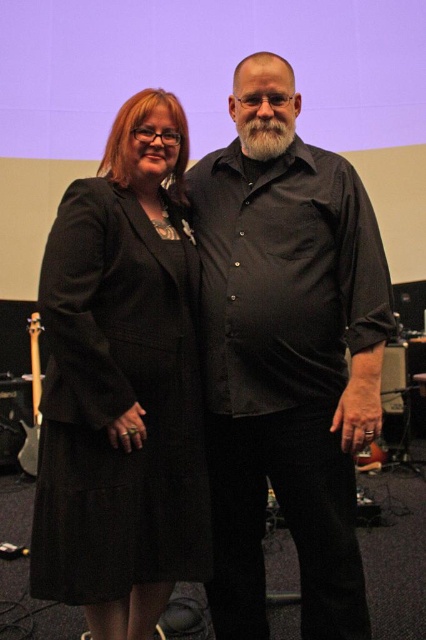
You are a photographer setting up for a photoshoot. You have a matte black shirt at center and a matte black guitar at lower left in your frame. Which object is wider when viewed from your camera position?

The matte black shirt at center is wider than the matte black guitar at lower left.

From the picture: You are standing at the point labeled point (x=294, y=195) and want to take a photo of the two people in the scene. If your camera is 1.82 meters away from the point, will the two people fit entirely within the camera frame?

The point labeled point (x=294, y=195) and the camera are 1.82 meters apart, so yes, the two people will fit entirely within the camera frame since the distance matches the camera range.